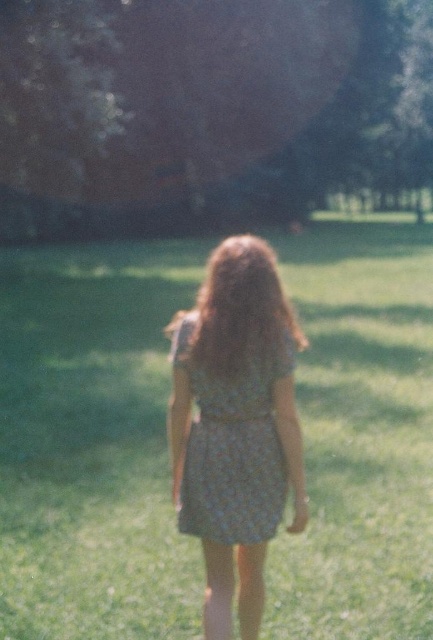
Looking at this image, does green textured grass at center have a greater width compared to floral dress at center?

Yes, green textured grass at center is wider than floral dress at center.

Can you confirm if green textured grass at center is positioned below floral dress at center?

No, green textured grass at center is not below floral dress at center.

At what (x,y) coordinates should I click in order to perform the action: click on green textured grass at center. Please return your answer as a coordinate pair (x, y). Looking at the image, I should click on (91, 444).

Identify the location of green textured grass at center. (91, 444).

Can you confirm if green textured grass at center is positioned to the right of floral-patterned fabric dress at center?

In fact, green textured grass at center is to the left of floral-patterned fabric dress at center.

Is green textured grass at center thinner than floral-patterned fabric dress at center?

No.

The height and width of the screenshot is (640, 433). I want to click on green textured grass at center, so click(91, 444).

Is point (293, 323) positioned in front of point (267, 358)?

That is False.

Is floral dress at center shorter than floral-patterned fabric dress at center?

Yes, floral dress at center is shorter than floral-patterned fabric dress at center.

This screenshot has width=433, height=640. What do you see at coordinates (235, 426) in the screenshot? I see `floral dress at center` at bounding box center [235, 426].

This screenshot has width=433, height=640. Identify the location of floral dress at center. (235, 426).